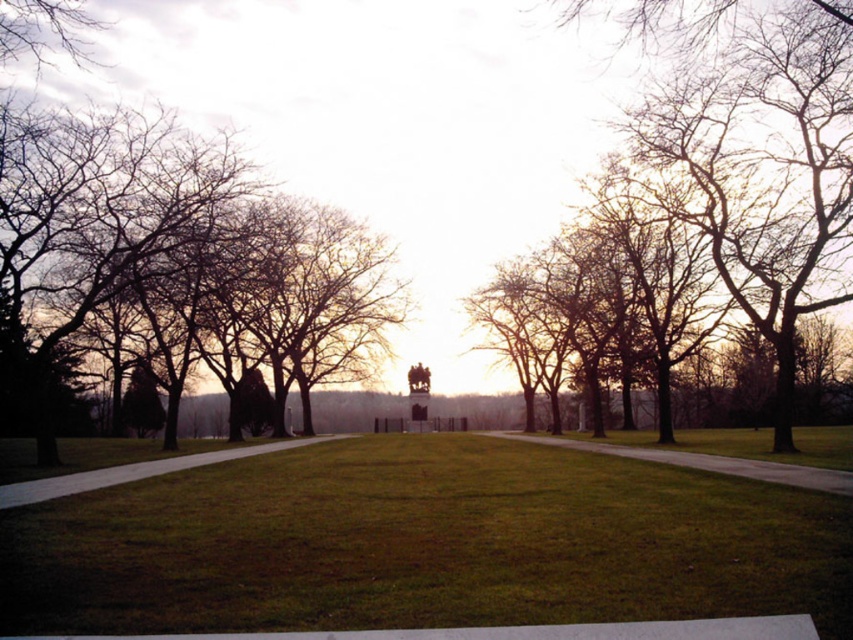
Question: Which of the following is the farthest from the observer?

Choices:
 (A) grassy sidewalk at center
 (B) smooth concrete path at lower left
 (C) brown leafless tree at left

Answer: (C)

Question: Which point appears closest to the camera in this image?

Choices:
 (A) (33, 490)
 (B) (622, 456)
 (C) (239, 556)
 (D) (90, 273)

Answer: (C)

Question: Which object is positioned farthest from the smooth concrete path at lower left?

Choices:
 (A) green grassy field at center
 (B) bare branches at center
 (C) brown leafless tree at left
 (D) grassy sidewalk at center

Answer: (B)

Question: Is grassy sidewalk at center bigger than smooth concrete path at lower left?

Choices:
 (A) no
 (B) yes

Answer: (B)

Question: Can you confirm if brown leafless tree at left is thinner than smooth concrete path at lower left?

Choices:
 (A) no
 (B) yes

Answer: (A)

Question: Is brown leafless tree at left to the left of grassy sidewalk at center from the viewer's perspective?

Choices:
 (A) yes
 (B) no

Answer: (A)